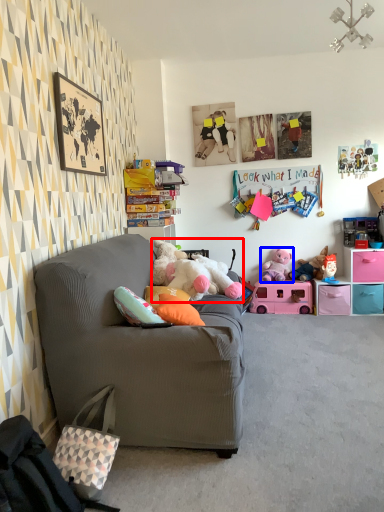
Question: Which object is further to the camera taking this photo, toy (highlighted by a red box) or toy (highlighted by a blue box)?

Choices:
 (A) toy
 (B) toy

Answer: (B)